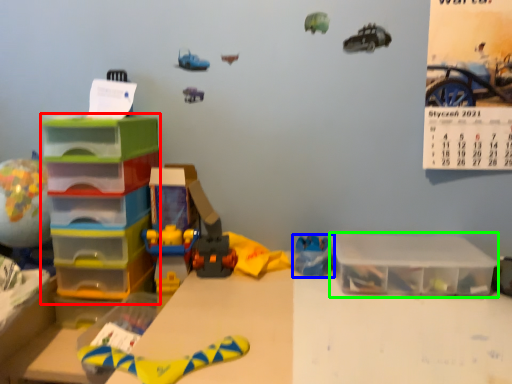
Question: Based on their relative distances, which object is farther from shelf (highlighted by a red box)? Choose from toy (highlighted by a blue box) and storage box (highlighted by a green box).

Choices:
 (A) toy
 (B) storage box

Answer: (B)